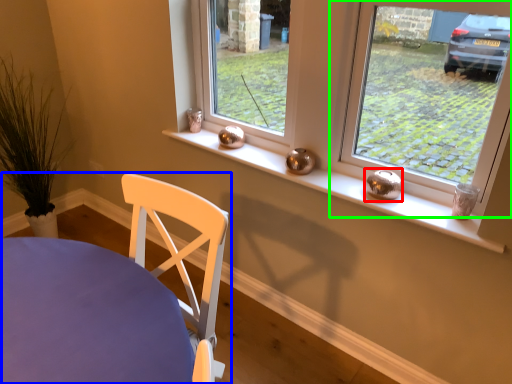
Question: Which object is positioned closest to candle holder (highlighted by a red box)? Select from chair (highlighted by a blue box) and window (highlighted by a green box).

Choices:
 (A) chair
 (B) window

Answer: (A)